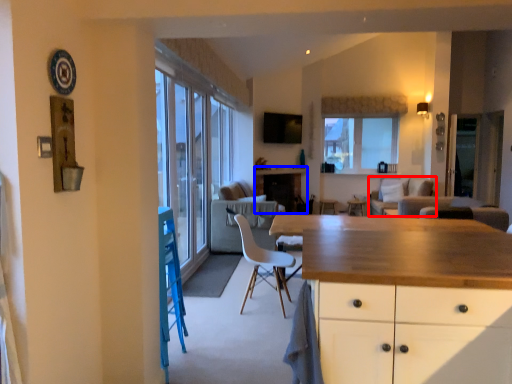
Question: Among these objects, which one is farthest to the camera, couch (highlighted by a red box) or counter (highlighted by a blue box)?

Choices:
 (A) couch
 (B) counter

Answer: (B)